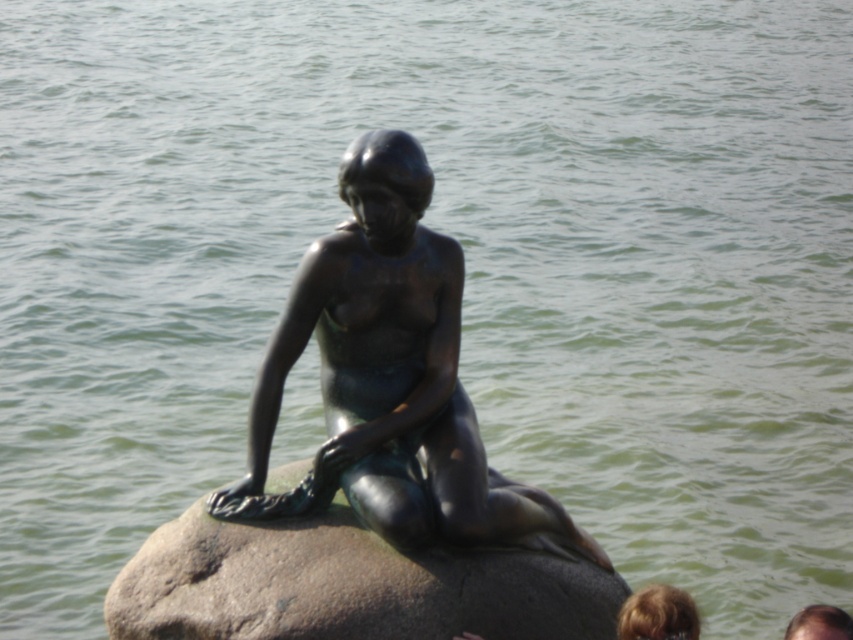
Is bronze statue at center above greenish-gray stone at center?

Yes, bronze statue at center is above greenish-gray stone at center.

Is bronze statue at center to the left of greenish-gray stone at center from the viewer's perspective?

Indeed, bronze statue at center is positioned on the left side of greenish-gray stone at center.

Is point (300, 506) more distant than point (201, 604)?

Yes.

The width and height of the screenshot is (853, 640). I want to click on bronze statue at center, so click(x=390, y=378).